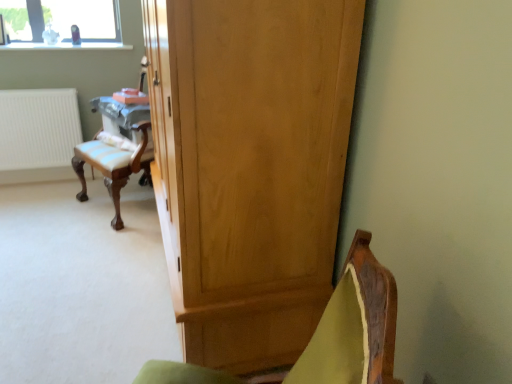
What are the coordinates of `light brown wood cupboard at center` in the screenshot? It's located at (250, 167).

The width and height of the screenshot is (512, 384). What do you see at coordinates (326, 334) in the screenshot?
I see `velvet green chair at lower right` at bounding box center [326, 334].

You are a GUI agent. You are given a task and a screenshot of the screen. Output one action in this format:
    pyautogui.click(x=<x>, y=<y>)
    Task: Click on the velvet green chair at lower right
    The height and width of the screenshot is (384, 512).
    Given the screenshot: What is the action you would take?
    pyautogui.click(x=326, y=334)

This screenshot has height=384, width=512. What are the coordinates of `white matte radiator at left` in the screenshot? It's located at (38, 128).

Is light brown wood cupboard at center not within velvet green chair at lower right?

Yes, light brown wood cupboard at center is located beyond the bounds of velvet green chair at lower right.

Who is shorter, light brown wood cupboard at center or velvet green chair at lower right?

Standing shorter between the two is velvet green chair at lower right.

Locate an element on the screen. Image resolution: width=512 pixels, height=384 pixels. cupboard on the left side of velvet green chair at lower right is located at coordinates (250, 167).

Considering the positions of points (362, 296) and (66, 150), is point (362, 296) closer to camera compared to point (66, 150)?

Yes, point (362, 296) is closer to viewer.

Consider the image. From a real-world perspective, is velvet green chair at lower right above or below white matte radiator at left?

From a real-world perspective, velvet green chair at lower right is physically above white matte radiator at left.

Considering the relative positions of velvet green chair at lower right and white matte radiator at left in the image provided, is velvet green chair at lower right to the left of white matte radiator at left from the viewer's perspective?

No.

What's the angular difference between velvet green chair at lower right and white matte radiator at left's facing directions?

115 degrees.

How many degrees apart are the facing directions of white matte radiator at left and velvet green chair at lower right?

The facing directions of white matte radiator at left and velvet green chair at lower right are 115 degrees apart.

Does white matte radiator at left have a larger size compared to velvet green chair at lower right?

No, white matte radiator at left is not bigger than velvet green chair at lower right.

Considering the relative sizes of white matte radiator at left and velvet green chair at lower right in the image provided, is white matte radiator at left shorter than velvet green chair at lower right?

Yes.

Find the location of `radiator on the left of velvet green chair at lower right`. radiator on the left of velvet green chair at lower right is located at coordinates (38, 128).

Considering the positions of objects white matte radiator at left and light brown wood cupboard at center in the image provided, who is more to the right, white matte radiator at left or light brown wood cupboard at center?

light brown wood cupboard at center is more to the right.

Between white matte radiator at left and light brown wood cupboard at center, which one has more height?

With more height is light brown wood cupboard at center.

Is white matte radiator at left beside light brown wood cupboard at center?

No, white matte radiator at left is not in contact with light brown wood cupboard at center.

Find the location of a particular element. cupboard that appears above the white matte radiator at left (from a real-world perspective) is located at coordinates (250, 167).

Does light brown wood cupboard at center have a lesser height compared to white matte radiator at left?

In fact, light brown wood cupboard at center may be taller than white matte radiator at left.

Is point (184, 348) positioned behind point (39, 165)?

That is False.

Is light brown wood cupboard at center outside of white matte radiator at left?

Indeed, light brown wood cupboard at center is completely outside white matte radiator at left.

From the picture: Which of these two, velvet green chair at lower right or light brown wood cupboard at center, is wider?

Wider between the two is velvet green chair at lower right.

Is velvet green chair at lower right not within light brown wood cupboard at center?

velvet green chair at lower right is positioned outside light brown wood cupboard at center.

Consider the image. Can you confirm if velvet green chair at lower right is positioned to the left of light brown wood cupboard at center?

No, velvet green chair at lower right is not to the left of light brown wood cupboard at center.

How much distance is there between velvet green chair at lower right and light brown wood cupboard at center?

The distance of velvet green chair at lower right from light brown wood cupboard at center is 20.86 inches.

Locate an element on the screen. chair that appears on the right of light brown wood cupboard at center is located at coordinates (326, 334).

I want to click on radiator on the left side of velvet green chair at lower right, so click(x=38, y=128).

Which object lies nearer to the anchor point white matte radiator at left, velvet green chair at lower right or light brown wood cupboard at center?

light brown wood cupboard at center lies closer to white matte radiator at left than the other object.

From the image, which object appears to be farther from velvet green chair at lower right, light brown wood cupboard at center or white matte radiator at left?

Based on the image, white matte radiator at left appears to be further to velvet green chair at lower right.

Estimate the real-world distances between objects in this image. Which object is closer to white matte radiator at left, light brown wood cupboard at center or velvet green chair at lower right?

light brown wood cupboard at center.

Which object lies further to the anchor point light brown wood cupboard at center, white matte radiator at left or velvet green chair at lower right?

Based on the image, white matte radiator at left appears to be further to light brown wood cupboard at center.

Considering their positions, is velvet green chair at lower right positioned closer to light brown wood cupboard at center than white matte radiator at left?

velvet green chair at lower right.

When comparing their distances from velvet green chair at lower right, does white matte radiator at left or light brown wood cupboard at center seem further?

white matte radiator at left is positioned further to the anchor velvet green chair at lower right.

At what (x,y) coordinates should I click in order to perform the action: click on cupboard between velvet green chair at lower right and white matte radiator at left in the front-back direction. Please return your answer as a coordinate pair (x, y). The width and height of the screenshot is (512, 384). Looking at the image, I should click on (250, 167).